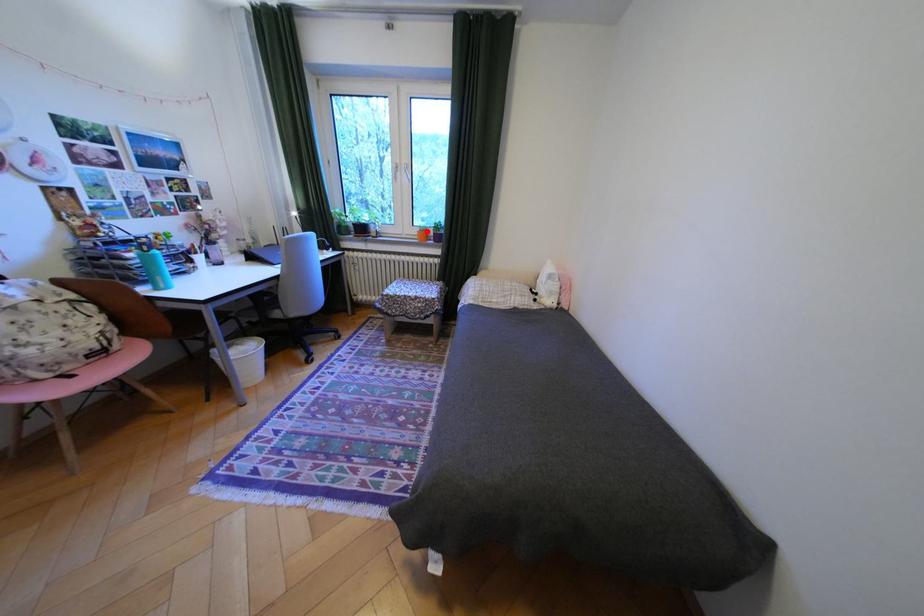
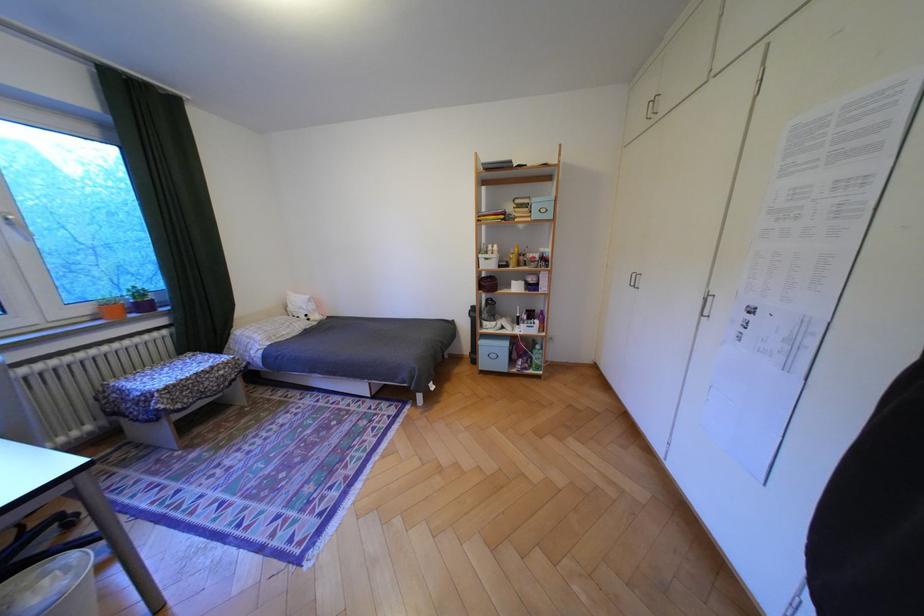
Locate, in the second image, the point that corresponds to the highlighted location in the first image.

(99, 310)